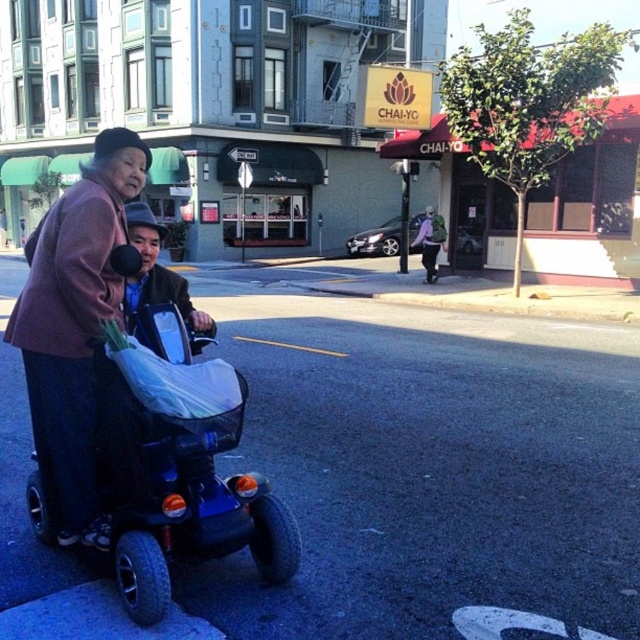
Question: Is blue plastic scooter at lower left further to camera compared to dark purple fabric jacket at left?

Choices:
 (A) no
 (B) yes

Answer: (A)

Question: Does blue plastic scooter at lower left have a lesser width compared to dark purple fabric jacket at left?

Choices:
 (A) no
 (B) yes

Answer: (B)

Question: From the image, what is the correct spatial relationship of blue plastic scooter at lower left in relation to dark purple fabric jacket at left?

Choices:
 (A) below
 (B) above

Answer: (A)

Question: Which point is closer to the camera?

Choices:
 (A) pos(269,536)
 (B) pos(35,280)

Answer: (B)

Question: Which point is closer to the camera?

Choices:
 (A) blue plastic scooter at lower left
 (B) dark purple fabric jacket at left

Answer: (A)